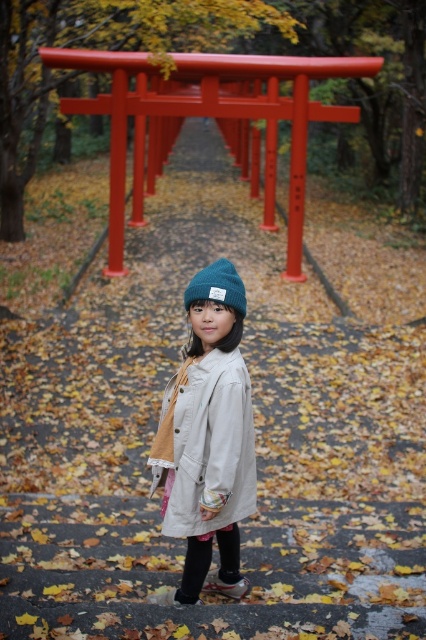
Question: Does matte beige coat at center appear on the right side of knitted woolen beanie at center?

Choices:
 (A) no
 (B) yes

Answer: (A)

Question: Observing the image, what is the correct spatial positioning of matte beige coat at center in reference to knitted woolen beanie at center?

Choices:
 (A) left
 (B) right

Answer: (A)

Question: Which point is closer to the camera?

Choices:
 (A) (180, 426)
 (B) (229, 291)

Answer: (B)

Question: Is matte beige coat at center below knitted woolen beanie at center?

Choices:
 (A) yes
 (B) no

Answer: (A)